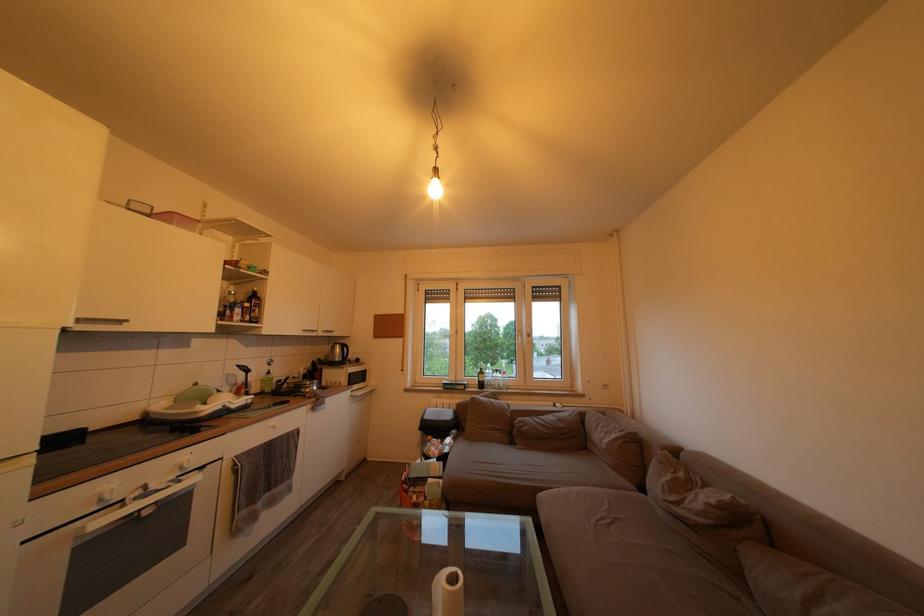
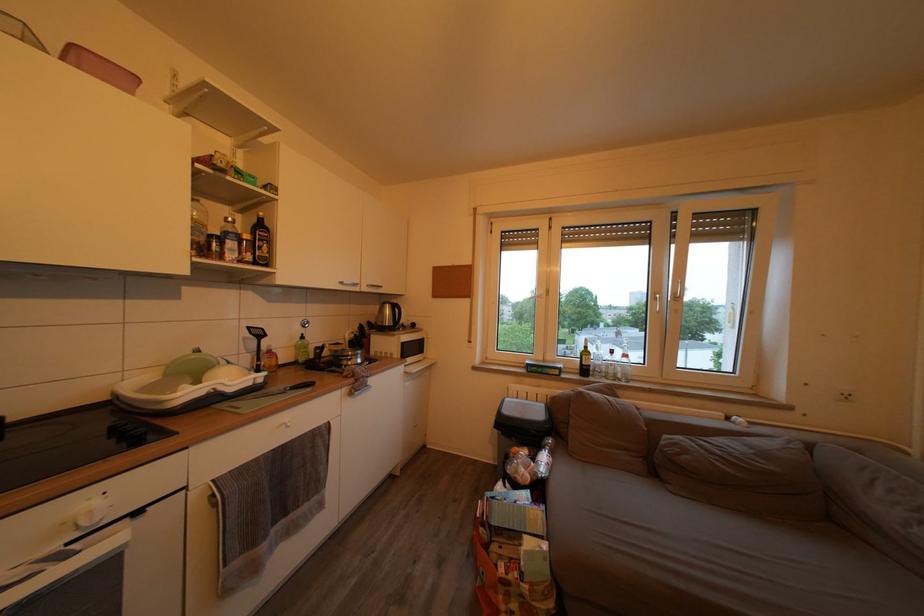
Locate, in the second image, the point that corresponds to (197,463) in the first image.

(103, 508)